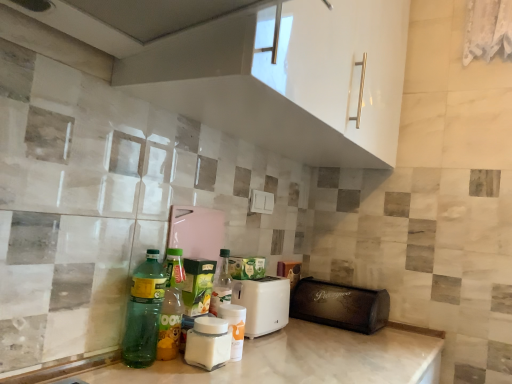
Question: Is white plastic toaster at center, the second appliance viewed from the right, thinner than green translucent bottle at lower left, the 1th bottle when ordered from left to right?

Choices:
 (A) no
 (B) yes

Answer: (A)

Question: Is white plastic toaster at center, which ranks as the first appliance in left-to-right order, facing towards green translucent bottle at lower left, which is counted as the fourth bottle, starting from the right?

Choices:
 (A) yes
 (B) no

Answer: (B)

Question: Is white plastic toaster at center, the second appliance viewed from the right, taller than green translucent bottle at lower left, which is counted as the fourth bottle, starting from the right?

Choices:
 (A) yes
 (B) no

Answer: (B)

Question: Is green translucent bottle at lower left, which is counted as the fourth bottle, starting from the right, a part of white plastic toaster at center, the second appliance viewed from the right?

Choices:
 (A) yes
 (B) no

Answer: (B)

Question: From a real-world perspective, does white plastic toaster at center, the second appliance viewed from the right, stand above green translucent bottle at lower left, the 1th bottle when ordered from left to right?

Choices:
 (A) no
 (B) yes

Answer: (A)

Question: Is white plastic toaster at center, which ranks as the first appliance in left-to-right order, turned away from green translucent bottle at lower left, which is counted as the fourth bottle, starting from the right?

Choices:
 (A) yes
 (B) no

Answer: (B)

Question: From a real-world perspective, is black leather bread bin at lower right, placed as the 2th appliance when sorted from left to right, under white glossy jar at center, marked as the first bottle in a right-to-left arrangement?

Choices:
 (A) no
 (B) yes

Answer: (A)

Question: Is black leather bread bin at lower right, placed as the 2th appliance when sorted from left to right, placed right next to white glossy jar at center, placed as the fourth bottle when sorted from left to right?

Choices:
 (A) no
 (B) yes

Answer: (A)

Question: Can you confirm if black leather bread bin at lower right, the first appliance from the right, is thinner than white glossy jar at center, marked as the first bottle in a right-to-left arrangement?

Choices:
 (A) yes
 (B) no

Answer: (B)

Question: Is black leather bread bin at lower right, placed as the 2th appliance when sorted from left to right, turned away from white glossy jar at center, marked as the first bottle in a right-to-left arrangement?

Choices:
 (A) yes
 (B) no

Answer: (B)

Question: Considering the relative sizes of black leather bread bin at lower right, placed as the 2th appliance when sorted from left to right, and white glossy jar at center, placed as the fourth bottle when sorted from left to right, in the image provided, is black leather bread bin at lower right, placed as the 2th appliance when sorted from left to right, wider than white glossy jar at center, placed as the fourth bottle when sorted from left to right,?

Choices:
 (A) yes
 (B) no

Answer: (A)

Question: Considering the relative positions of black leather bread bin at lower right, placed as the 2th appliance when sorted from left to right, and white glossy jar at center, marked as the first bottle in a right-to-left arrangement, in the image provided, is black leather bread bin at lower right, placed as the 2th appliance when sorted from left to right, to the left of white glossy jar at center, marked as the first bottle in a right-to-left arrangement, from the viewer's perspective?

Choices:
 (A) yes
 (B) no

Answer: (B)

Question: From the image's perspective, is green translucent bottle at lower left, which is counted as the fourth bottle, starting from the right, located above white glossy jar at center, marked as the first bottle in a right-to-left arrangement?

Choices:
 (A) no
 (B) yes

Answer: (B)